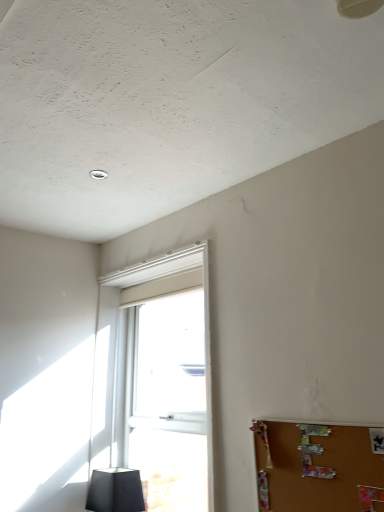
Image resolution: width=384 pixels, height=512 pixels. What are the coordinates of `matte black lampshade at lower left` in the screenshot? It's located at point(115,490).

This screenshot has height=512, width=384. Identify the location of brown corkboard at lower right. (316, 467).

Considering the positions of objects matte black lampshade at lower left and white plastic window at center in the image provided, who is more to the right, matte black lampshade at lower left or white plastic window at center?

Positioned to the right is white plastic window at center.

Considering the relative positions of matte black lampshade at lower left and white plastic window at center in the image provided, is matte black lampshade at lower left in front of white plastic window at center?

No, matte black lampshade at lower left is further to the viewer.

Is white plastic window at center surrounded by matte black lampshade at lower left?

No, white plastic window at center is not surrounded by matte black lampshade at lower left.

Who is taller, brown corkboard at lower right or matte black lampshade at lower left?

brown corkboard at lower right is taller.

Can you confirm if brown corkboard at lower right is bigger than matte black lampshade at lower left?

Actually, brown corkboard at lower right might be smaller than matte black lampshade at lower left.

Which object is thinner, brown corkboard at lower right or matte black lampshade at lower left?

With smaller width is brown corkboard at lower right.

Is white plastic window at center inside the boundaries of matte black lampshade at lower left, or outside?

white plastic window at center cannot be found inside matte black lampshade at lower left.

Visually, is white plastic window at center positioned to the left or to the right of matte black lampshade at lower left?

From the image, it's evident that white plastic window at center is to the right of matte black lampshade at lower left.

Considering the sizes of white plastic window at center and matte black lampshade at lower left in the image, is white plastic window at center taller or shorter than matte black lampshade at lower left?

Considering their sizes, white plastic window at center has more height than matte black lampshade at lower left.

From a real-world perspective, is white plastic window at center located beneath matte black lampshade at lower left?

No, from a real-world perspective, white plastic window at center is not beneath matte black lampshade at lower left.

Can you confirm if white plastic window at center is positioned to the right of brown corkboard at lower right?

Incorrect, white plastic window at center is not on the right side of brown corkboard at lower right.

Between white plastic window at center and brown corkboard at lower right, which one has larger size?

white plastic window at center is bigger.

Can brown corkboard at lower right be found inside white plastic window at center?

No, brown corkboard at lower right is not inside white plastic window at center.

Which point is more distant from viewer, (139, 489) or (378, 480)?

Point (139, 489)

Does matte black lampshade at lower left have a larger size compared to brown corkboard at lower right?

Yes.

Considering the sizes of matte black lampshade at lower left and brown corkboard at lower right in the image, is matte black lampshade at lower left wider or thinner than brown corkboard at lower right?

In the image, matte black lampshade at lower left appears to be wider than brown corkboard at lower right.

How many degrees apart are the facing directions of matte black lampshade at lower left and brown corkboard at lower right?

2.65 degrees separate the facing orientations of matte black lampshade at lower left and brown corkboard at lower right.

Which object is positioned more to the right, brown corkboard at lower right or white plastic window at center?

From the viewer's perspective, brown corkboard at lower right appears more on the right side.

Is brown corkboard at lower right oriented towards white plastic window at center?

No, brown corkboard at lower right is not turned towards white plastic window at center.

Is brown corkboard at lower right wider than white plastic window at center?

No.

Is point (267, 475) closer to camera compared to point (206, 361)?

Yes, point (267, 475) is in front of point (206, 361).

In order to click on lamp that is under the white plastic window at center (from a real-world perspective) in this screenshot , I will do `click(115, 490)`.

Identify the location of bulletin board on the right of matte black lampshade at lower left. This screenshot has width=384, height=512. (316, 467).

Based on their spatial positions, is matte black lampshade at lower left or brown corkboard at lower right further from white plastic window at center?

The object further to white plastic window at center is brown corkboard at lower right.

Based on their spatial positions, is white plastic window at center or matte black lampshade at lower left further from brown corkboard at lower right?

matte black lampshade at lower left is further to brown corkboard at lower right.

Considering their positions, is white plastic window at center positioned further to matte black lampshade at lower left than brown corkboard at lower right?

Based on the image, brown corkboard at lower right appears to be further to matte black lampshade at lower left.

When comparing their distances from white plastic window at center, does brown corkboard at lower right or matte black lampshade at lower left seem further?

brown corkboard at lower right is further to white plastic window at center.

Looking at the image, which one is located further to brown corkboard at lower right, matte black lampshade at lower left or white plastic window at center?

matte black lampshade at lower left.

Looking at the image, which one is located further to matte black lampshade at lower left, brown corkboard at lower right or white plastic window at center?

brown corkboard at lower right is positioned further to the anchor matte black lampshade at lower left.

At what (x,y) coordinates should I click in order to perform the action: click on window between brown corkboard at lower right and matte black lampshade at lower left along the z-axis. Please return your answer as a coordinate pair (x, y). Looking at the image, I should click on pos(157,378).